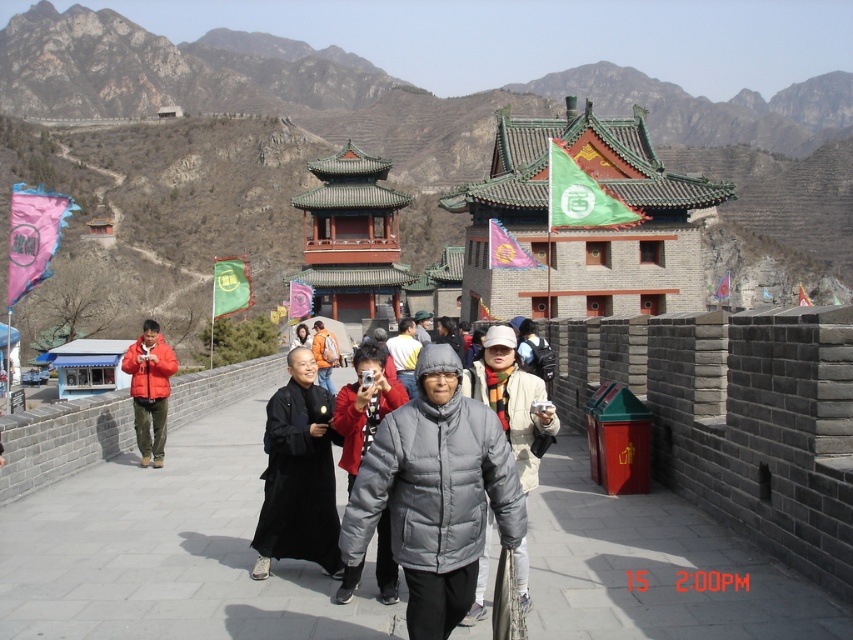
Is black matte robe at center to the left of matte orange jacket at center from the viewer's perspective?

No, black matte robe at center is not to the left of matte orange jacket at center.

Is point (299, 515) more distant than point (149, 381)?

No, (299, 515) is closer to viewer.

This screenshot has height=640, width=853. Describe the element at coordinates (299, 474) in the screenshot. I see `black matte robe at center` at that location.

At what (x,y) coordinates should I click in order to perform the action: click on black matte robe at center. Please return your answer as a coordinate pair (x, y). Looking at the image, I should click on (299, 474).

Is point (393, 573) behind point (138, 435)?

That is False.

Can you confirm if matte gray coat at center is positioned to the left of matte orange jacket at center?

Incorrect, matte gray coat at center is not on the left side of matte orange jacket at center.

Does point (393, 394) come behind point (151, 326)?

That is False.

At what (x,y) coordinates should I click in order to perform the action: click on matte gray coat at center. Please return your answer as a coordinate pair (x, y). This screenshot has height=640, width=853. Looking at the image, I should click on (363, 406).

Can you confirm if gray down jacket at center is positioned to the right of orange fabric jacket at center?

Correct, you'll find gray down jacket at center to the right of orange fabric jacket at center.

Does gray down jacket at center appear under orange fabric jacket at center?

Yes.

Which is behind, point (375, 493) or point (337, 358)?

Point (337, 358)

I want to click on gray down jacket at center, so click(x=433, y=496).